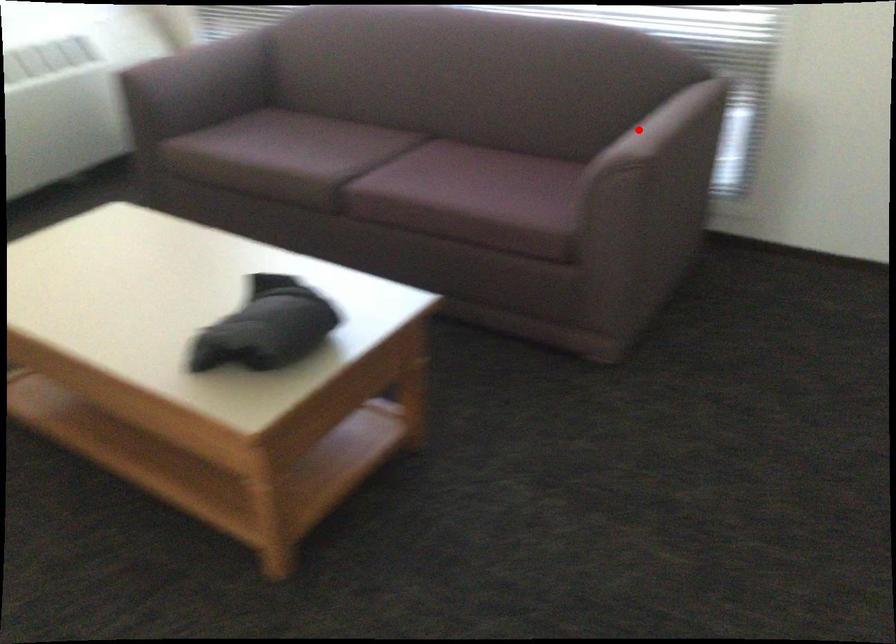
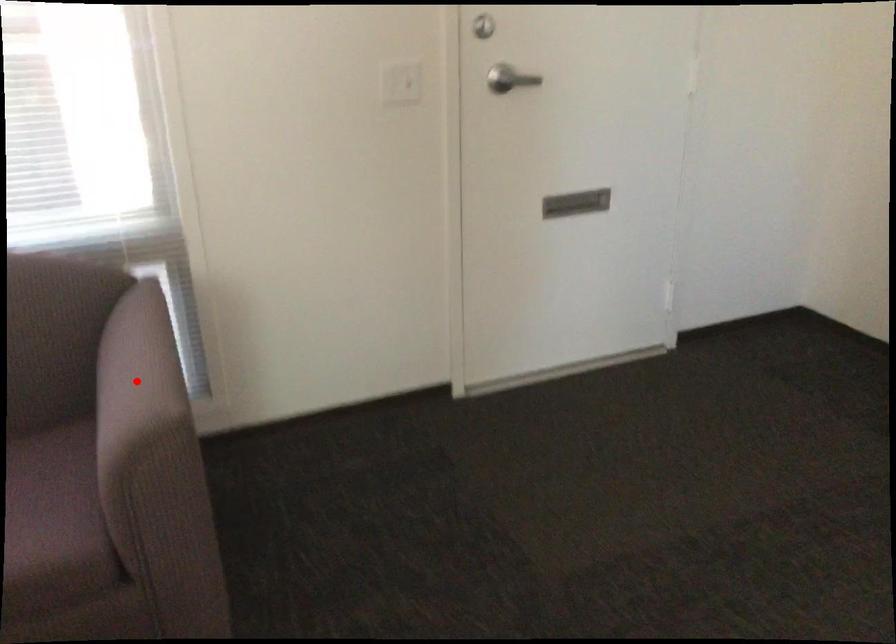
I am providing you with two images of the same scene from different viewpoints. A red point is marked on the first image and another point is marked on the second image. Is the red point in image1 aligned with the point shown in image2?

Yes